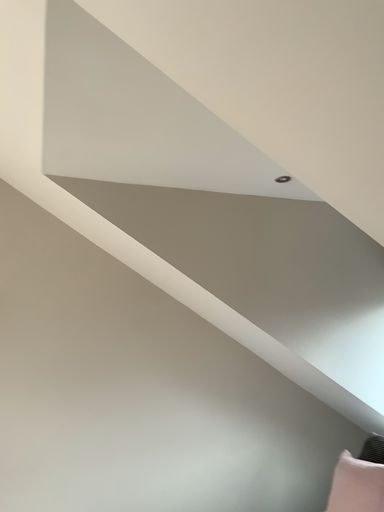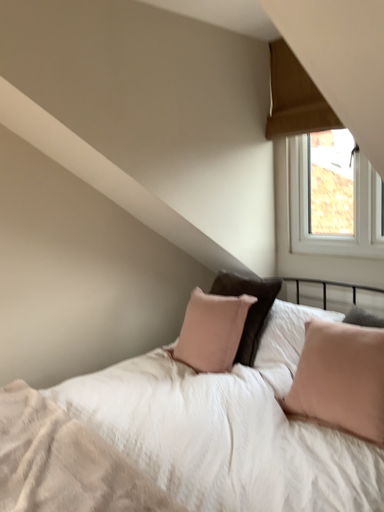
Question: How did the camera likely rotate when shooting the video?

Choices:
 (A) rotated right
 (B) rotated left

Answer: (A)